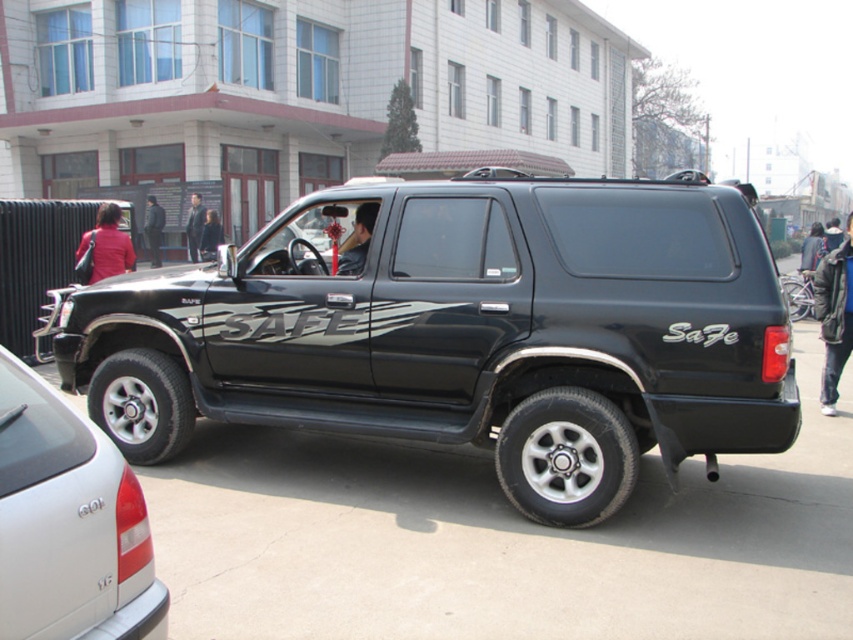
Which is above, matte black suv at center or glossy black suv at center?

matte black suv at center is higher up.

Describe the element at coordinates (462, 332) in the screenshot. I see `matte black suv at center` at that location.

This screenshot has width=853, height=640. Describe the element at coordinates (462, 332) in the screenshot. I see `matte black suv at center` at that location.

Image resolution: width=853 pixels, height=640 pixels. Identify the location of matte black suv at center. (462, 332).